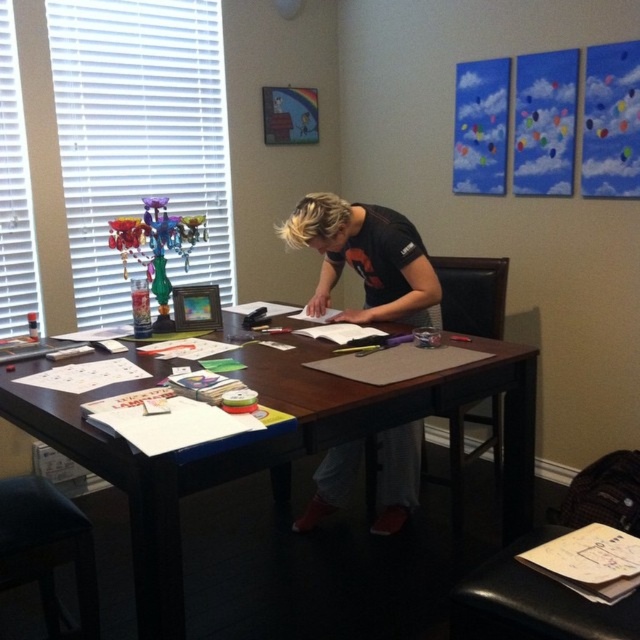
Question: Where is wooden table at center located in relation to black leather stool at lower left in the image?

Choices:
 (A) left
 (B) right

Answer: (B)

Question: Is wooden table at center positioned at the back of black fabric shirt at center?

Choices:
 (A) no
 (B) yes

Answer: (A)

Question: Which of the following is the farthest from the observer?

Choices:
 (A) black leather stool at lower left
 (B) wooden table at center
 (C) black fabric shirt at center

Answer: (C)

Question: Which point appears farthest from the camera in this image?

Choices:
 (A) (92, 632)
 (B) (332, 616)

Answer: (B)

Question: Is black fabric shirt at center to the right of black leather stool at lower left from the viewer's perspective?

Choices:
 (A) yes
 (B) no

Answer: (A)

Question: Which of the following is the farthest from the observer?

Choices:
 (A) (416, 438)
 (B) (307, 540)

Answer: (B)